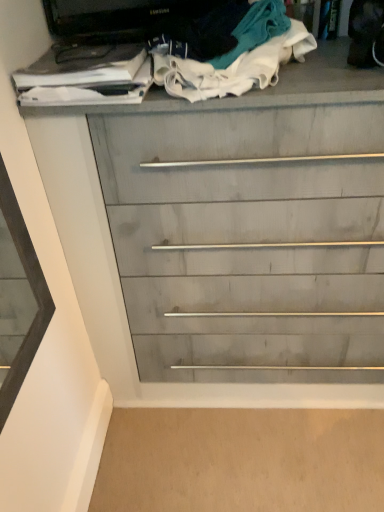
Question: Considering the relative positions of gray wood chest of drawers at center and white cotton cloth at upper center, arranged as the 2th clothing when viewed from the left, in the image provided, is gray wood chest of drawers at center to the left of white cotton cloth at upper center, arranged as the 2th clothing when viewed from the left, from the viewer's perspective?

Choices:
 (A) no
 (B) yes

Answer: (A)

Question: Can you confirm if gray wood chest of drawers at center is shorter than white cotton cloth at upper center, arranged as the 2th clothing when viewed from the left?

Choices:
 (A) no
 (B) yes

Answer: (A)

Question: Is gray wood chest of drawers at center further to the viewer compared to white cotton cloth at upper center, arranged as the 2th clothing when viewed from the left?

Choices:
 (A) yes
 (B) no

Answer: (A)

Question: Can you confirm if gray wood chest of drawers at center is smaller than white cotton cloth at upper center, the first clothing in the right-to-left sequence?

Choices:
 (A) yes
 (B) no

Answer: (B)

Question: Can you confirm if gray wood chest of drawers at center is taller than white cotton cloth at upper center, the first clothing in the right-to-left sequence?

Choices:
 (A) no
 (B) yes

Answer: (B)

Question: From the image's perspective, is white cotton socks at upper center, which ranks as the first clothing in left-to-right order, above or below white cotton cloth at upper center, arranged as the 2th clothing when viewed from the left?

Choices:
 (A) below
 (B) above

Answer: (A)

Question: Choose the correct answer: Is white cotton socks at upper center, which ranks as the first clothing in left-to-right order, inside white cotton cloth at upper center, the first clothing in the right-to-left sequence, or outside it?

Choices:
 (A) inside
 (B) outside

Answer: (B)

Question: In terms of height, does white cotton socks at upper center, which is counted as the 2th clothing, starting from the right, look taller or shorter compared to white cotton cloth at upper center, arranged as the 2th clothing when viewed from the left?

Choices:
 (A) tall
 (B) short

Answer: (B)

Question: Considering the positions of point (100, 80) and point (261, 53), is point (100, 80) closer or farther from the camera than point (261, 53)?

Choices:
 (A) farther
 (B) closer

Answer: (B)

Question: From a real-world perspective, relative to white cotton socks at upper center, which ranks as the first clothing in left-to-right order, is gray wood chest of drawers at center vertically above or below?

Choices:
 (A) above
 (B) below

Answer: (B)

Question: Considering the positions of gray wood chest of drawers at center and white cotton socks at upper center, which is counted as the 2th clothing, starting from the right, in the image, is gray wood chest of drawers at center bigger or smaller than white cotton socks at upper center, which is counted as the 2th clothing, starting from the right,?

Choices:
 (A) big
 (B) small

Answer: (A)

Question: Considering their positions, is gray wood chest of drawers at center located in front of or behind white cotton socks at upper center, which is counted as the 2th clothing, starting from the right?

Choices:
 (A) behind
 (B) front

Answer: (B)

Question: Visually, is gray wood chest of drawers at center positioned to the left or to the right of white cotton socks at upper center, which ranks as the first clothing in left-to-right order?

Choices:
 (A) right
 (B) left

Answer: (A)

Question: Does point (367, 402) appear closer or farther from the camera than point (157, 47)?

Choices:
 (A) closer
 (B) farther

Answer: (B)

Question: Is gray wood chest of drawers at center spatially inside white cotton cloth at upper center, the first clothing in the right-to-left sequence, or outside of it?

Choices:
 (A) inside
 (B) outside

Answer: (B)